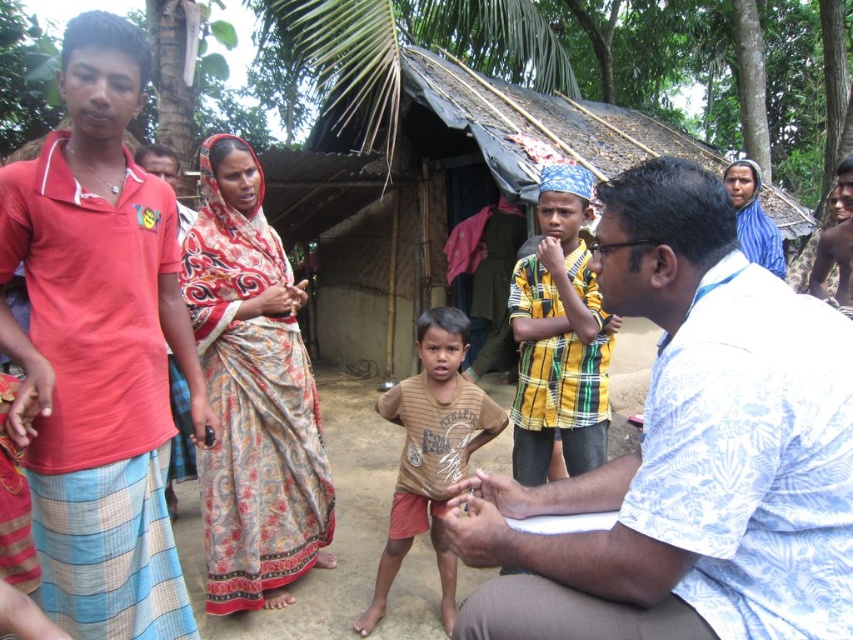
Question: Which point is closer to the camera?

Choices:
 (A) brown cotton shirt at center
 (B) yellow-green plaid shirt at center
 (C) white floral shirt at center
 (D) printed silk sari at center

Answer: (C)

Question: Which point is closer to the camera?

Choices:
 (A) (538, 177)
 (B) (212, 582)
 (C) (498, 534)
 (D) (740, 209)

Answer: (C)

Question: Which point appears closest to the camera in this image?

Choices:
 (A) (741, 173)
 (B) (231, 449)
 (C) (466, 406)

Answer: (C)

Question: Is white floral shirt at center thinner than blue printed sari at upper right?

Choices:
 (A) no
 (B) yes

Answer: (A)

Question: Does brown cotton shirt at center have a smaller size compared to blue printed sari at upper right?

Choices:
 (A) no
 (B) yes

Answer: (B)

Question: Is white floral shirt at center thinner than blue printed sari at upper right?

Choices:
 (A) no
 (B) yes

Answer: (A)